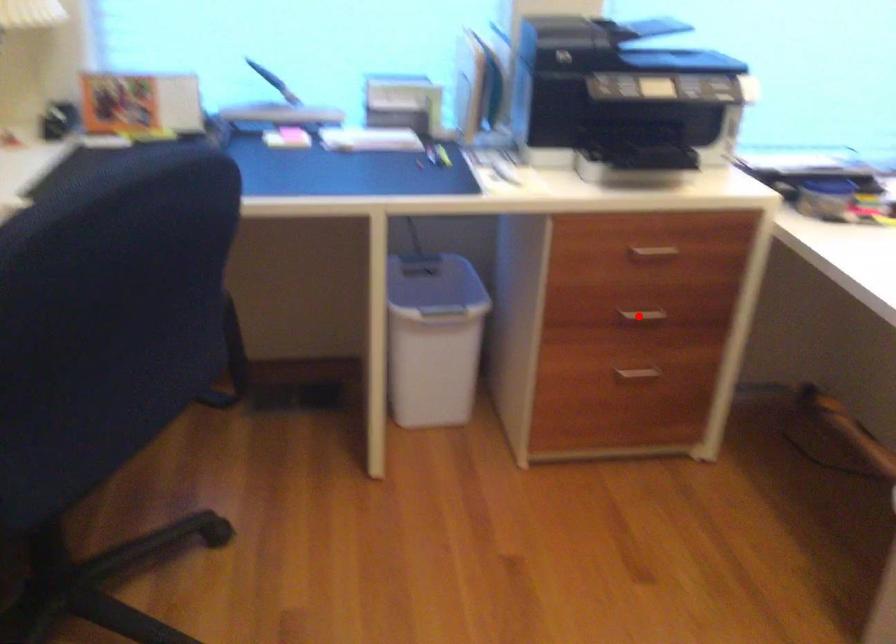
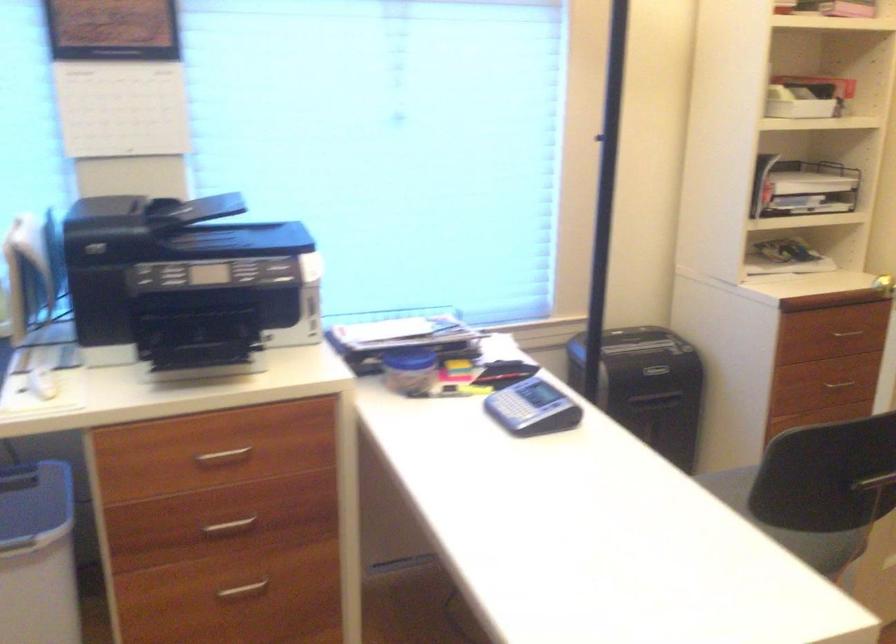
Question: I am providing you with two images of the same scene from different viewpoints. Image1 has a red point marked. In image2, the corresponding 3D location appears at what relative position? Reply with the corresponding letter.

Choices:
 (A) Closer
 (B) Farther

Answer: (A)